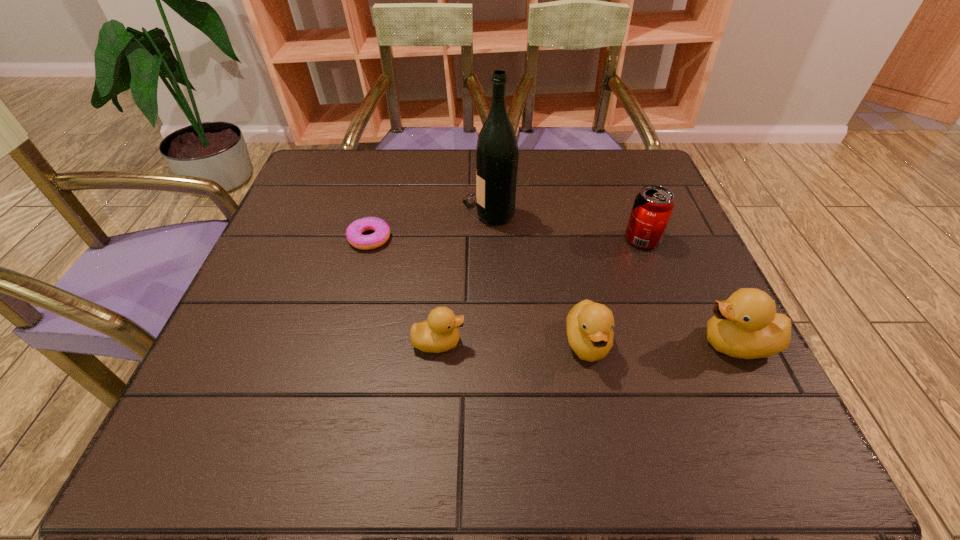
Locate an element on the screen. the leftmost duckling is located at coordinates (x=439, y=333).

Where is `the fifth tallest object`? the fifth tallest object is located at coordinates (439, 333).

Where is `the second tallest duckling`? the second tallest duckling is located at coordinates (589, 325).

This screenshot has height=540, width=960. I want to click on the second duckling from right to left, so click(589, 325).

I want to click on the rightmost duckling, so click(x=746, y=325).

The height and width of the screenshot is (540, 960). Identify the location of the shortest object. (354, 231).

This screenshot has height=540, width=960. Identify the location of doughnut. (354, 231).

Find the location of a particular element. The height and width of the screenshot is (540, 960). soda can is located at coordinates (653, 205).

The image size is (960, 540). Find the location of `the tallest object`. the tallest object is located at coordinates (497, 154).

Locate an element on the screen. The width and height of the screenshot is (960, 540). free region located 0.380m on the face of the second shortest object is located at coordinates (670, 342).